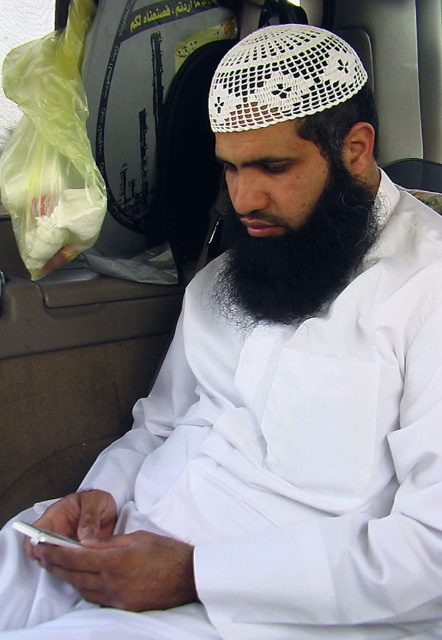
Question: Which of the following is the closest to the observer?

Choices:
 (A) (281, 316)
 (B) (136, 16)

Answer: (A)

Question: Which point is closer to the camera?

Choices:
 (A) white paper sign at upper center
 (B) black matte beard at center

Answer: (B)

Question: Can you confirm if black matte beard at center is bigger than white paper sign at upper center?

Choices:
 (A) no
 (B) yes

Answer: (B)

Question: Is black matte beard at center to the left of white paper sign at upper center from the viewer's perspective?

Choices:
 (A) no
 (B) yes

Answer: (A)

Question: Does black matte beard at center appear under white paper sign at upper center?

Choices:
 (A) no
 (B) yes

Answer: (B)